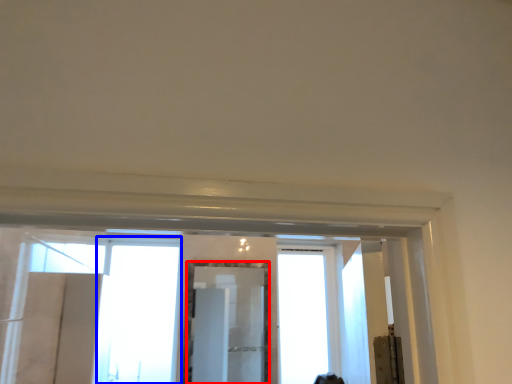
Question: Which object appears farthest to the camera in this image, mirror (highlighted by a red box) or window (highlighted by a blue box)?

Choices:
 (A) mirror
 (B) window

Answer: (B)